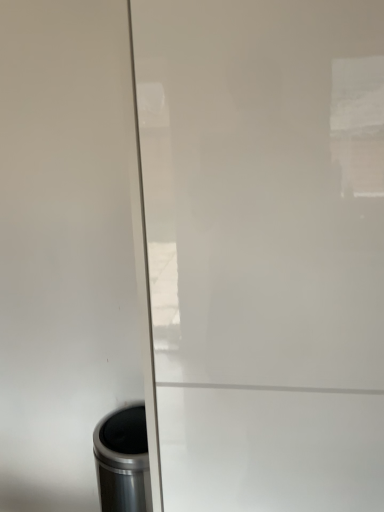
Image resolution: width=384 pixels, height=512 pixels. In order to click on metallic trash can at lower left in this screenshot , I will do `click(123, 461)`.

What do you see at coordinates (123, 461) in the screenshot?
I see `metallic trash can at lower left` at bounding box center [123, 461].

In order to face metallic trash can at lower left, should I rotate leftwards or rightwards?

You should rotate left by 8.563 degrees.

Describe the element at coordinates (265, 249) in the screenshot. I see `white glossy screen door at center` at that location.

The width and height of the screenshot is (384, 512). I want to click on white glossy screen door at center, so click(x=265, y=249).

You are a GUI agent. You are given a task and a screenshot of the screen. Output one action in this format:
    pyautogui.click(x=<x>, y=<y>)
    Task: Click on the metallic trash can at lower left
    
    Given the screenshot: What is the action you would take?
    tap(123, 461)

Is white glossy screen door at center to the left of metallic trash can at lower left from the viewer's perspective?

Incorrect, white glossy screen door at center is not on the left side of metallic trash can at lower left.

Does white glossy screen door at center lie behind metallic trash can at lower left?

Result: No, white glossy screen door at center is in front of metallic trash can at lower left.

Is point (193, 482) less distant than point (117, 459)?

Yes, it is.

From the image's perspective, is white glossy screen door at center beneath metallic trash can at lower left?

No, from the image's perspective, white glossy screen door at center is not below metallic trash can at lower left.

From a real-world perspective, between white glossy screen door at center and metallic trash can at lower left, who is vertically lower?

In real-world perspective, metallic trash can at lower left is lower.

Is white glossy screen door at center thinner than metallic trash can at lower left?

Incorrect, the width of white glossy screen door at center is not less than that of metallic trash can at lower left.

From their relative heights in the image, would you say white glossy screen door at center is taller or shorter than metallic trash can at lower left?

Considering their sizes, white glossy screen door at center has more height than metallic trash can at lower left.

Is white glossy screen door at center bigger or smaller than metallic trash can at lower left?

In the image, white glossy screen door at center appears to be larger than metallic trash can at lower left.

Is white glossy screen door at center surrounding metallic trash can at lower left?

No, metallic trash can at lower left is not inside white glossy screen door at center.

Would you consider white glossy screen door at center to be distant from metallic trash can at lower left?

Actually, white glossy screen door at center and metallic trash can at lower left are a little close together.

Does white glossy screen door at center turn towards metallic trash can at lower left?

No, white glossy screen door at center does not turn towards metallic trash can at lower left.

How different are the orientations of white glossy screen door at center and metallic trash can at lower left in degrees?

0.000905 degrees separate the facing orientations of white glossy screen door at center and metallic trash can at lower left.

You are a GUI agent. You are given a task and a screenshot of the screen. Output one action in this format:
    pyautogui.click(x=<x>, y=<y>)
    Task: Click on the screen door lying above the metallic trash can at lower left (from the image's perspective)
    Image resolution: width=384 pixels, height=512 pixels.
    Given the screenshot: What is the action you would take?
    pyautogui.click(x=265, y=249)

Is metallic trash can at lower left at the left side of white glossy screen door at center?

Yes, metallic trash can at lower left is to the left of white glossy screen door at center.

Is metallic trash can at lower left in front of white glossy screen door at center?

No, metallic trash can at lower left is behind white glossy screen door at center.

Considering the positions of points (129, 470) and (245, 214), is point (129, 470) closer to camera compared to point (245, 214)?

No, (129, 470) is behind (245, 214).

Based on the photo, from the image's perspective, would you say metallic trash can at lower left is shown under white glossy screen door at center?

Yes, from the image's perspective, metallic trash can at lower left is below white glossy screen door at center.

From the picture: From a real-world perspective, is metallic trash can at lower left under white glossy screen door at center?

Yes, from a real-world perspective, metallic trash can at lower left is under white glossy screen door at center.

Which object is thinner, metallic trash can at lower left or white glossy screen door at center?

metallic trash can at lower left.

Is metallic trash can at lower left shorter than white glossy screen door at center?

Yes.

Does metallic trash can at lower left have a smaller size compared to white glossy screen door at center?

Yes, metallic trash can at lower left is smaller than white glossy screen door at center.

Is white glossy screen door at center a part of metallic trash can at lower left?

No, white glossy screen door at center is not surrounded by metallic trash can at lower left.

Is metallic trash can at lower left with white glossy screen door at center?

No, metallic trash can at lower left is not beside white glossy screen door at center.

Is white glossy screen door at center at the back of metallic trash can at lower left?

That's not correct — metallic trash can at lower left is not looking away from white glossy screen door at center.

How distant is metallic trash can at lower left from white glossy screen door at center?

metallic trash can at lower left is 96.98 centimeters from white glossy screen door at center.

In order to click on waste container that is below the white glossy screen door at center (from the image's perspective) in this screenshot , I will do pyautogui.click(x=123, y=461).

Find the location of a particular element. The image size is (384, 512). waste container behind the white glossy screen door at center is located at coordinates (123, 461).

Identify the location of screen door that is on the right side of metallic trash can at lower left. (265, 249).